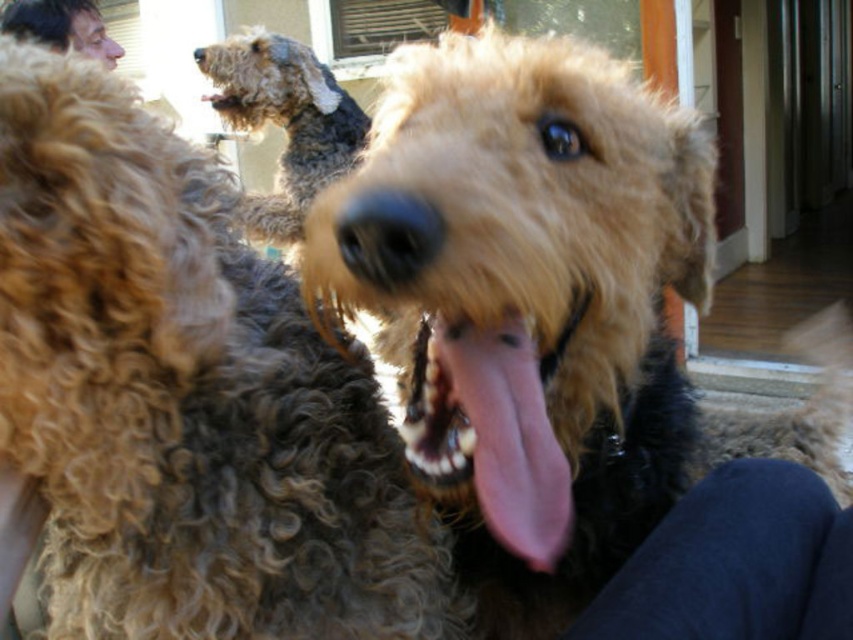
You are a photographer trying to capture a close detail shot of the pink glossy tongue at center and the curly brown fur at upper left. Which object should you focus on first if you want to ensure both are in focus without adjusting the camera settings?

The pink glossy tongue at center is smaller than the curly brown fur at upper left, so focusing on the larger curly brown fur at upper left first would help maintain focus on both objects.

You are a veterinarian examining the image of the dogs. You need to determine if the pink glossy tongue at center can fit entirely within the space occupied by the curly brown fur at upper left. Based on their sizes, what is your conclusion?

The pink glossy tongue at center has a width less than the curly brown fur at upper left, so it can fit entirely within the space occupied by the curly brown fur at upper left.